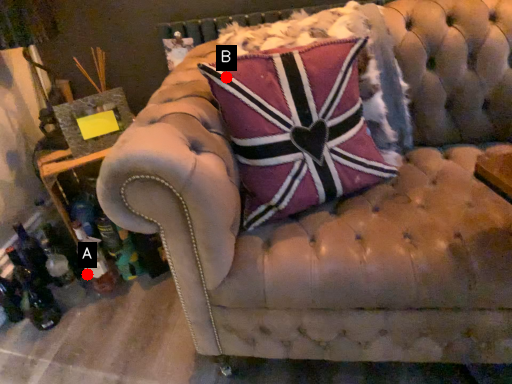
Question: Two points are circled on the image, labeled by A and B beside each circle. Which point is closer to the camera?

Choices:
 (A) A is closer
 (B) B is closer

Answer: (B)